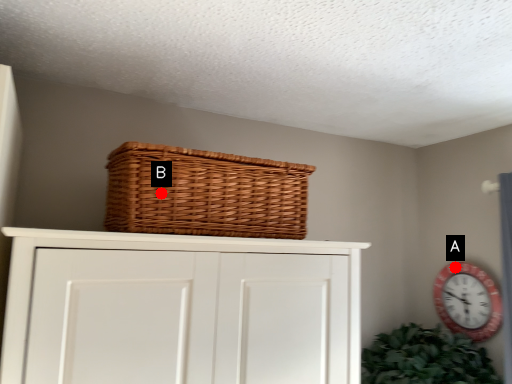
Question: Two points are circled on the image, labeled by A and B beside each circle. Which point is farther from the camera taking this photo?

Choices:
 (A) A is further
 (B) B is further

Answer: (A)